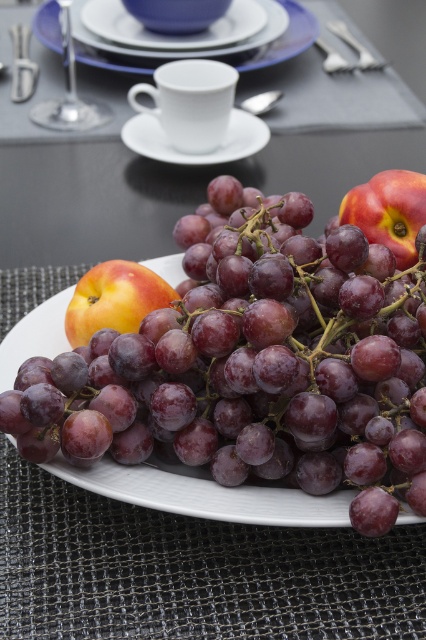
Question: Can you confirm if shiny purple grapes at center is positioned above matte white cup at upper center?

Choices:
 (A) yes
 (B) no

Answer: (B)

Question: Does shiny purple grapes at center appear under white ceramic saucer at upper center?

Choices:
 (A) yes
 (B) no

Answer: (A)

Question: In this image, where is white ceramic saucer at upper center located relative to matte white cup at upper center?

Choices:
 (A) left
 (B) right

Answer: (A)

Question: Among these objects, which one is farthest from the camera?

Choices:
 (A) white ceramic saucer at upper center
 (B) metallic silver wine glass at upper left
 (C) shiny purple grapes at center
 (D) matte peach at center

Answer: (A)

Question: Which point is closer to the camera?

Choices:
 (A) white ceramic saucer at upper center
 (B) matte white cup at upper center

Answer: (B)

Question: Which object is the farthest from the metallic silver wine glass at upper left?

Choices:
 (A) shiny red apple at center
 (B) matte white cup at upper center
 (C) white ceramic saucer at upper center
 (D) matte peach at center

Answer: (A)